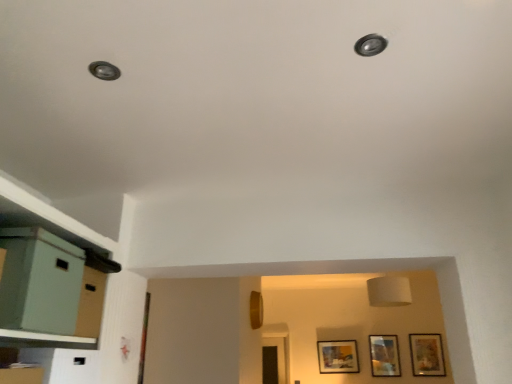
Question: Is matte gold picture frame at lower right, acting as the 3th picture frame starting from the left, taller than wooden picture frame at lower right, the second picture frame in the left-to-right sequence?

Choices:
 (A) no
 (B) yes

Answer: (B)

Question: Is matte gold picture frame at lower right, acting as the 3th picture frame starting from the left, oriented away from wooden picture frame at lower right, the second picture frame in the left-to-right sequence?

Choices:
 (A) yes
 (B) no

Answer: (B)

Question: From a real-world perspective, is matte gold picture frame at lower right, the first picture frame in the right-to-left sequence, physically below wooden picture frame at lower right, the second picture frame in the left-to-right sequence?

Choices:
 (A) yes
 (B) no

Answer: (B)

Question: Is matte gold picture frame at lower right, acting as the 3th picture frame starting from the left, located outside wooden picture frame at lower right, the 2th picture frame in the right-to-left sequence?

Choices:
 (A) yes
 (B) no

Answer: (A)

Question: Is matte gold picture frame at lower right, acting as the 3th picture frame starting from the left, to the left of wooden picture frame at lower right, the second picture frame in the left-to-right sequence, from the viewer's perspective?

Choices:
 (A) yes
 (B) no

Answer: (B)

Question: Visually, is matte gold picture frame at lower right, acting as the 3th picture frame starting from the left, positioned to the left or to the right of matte wooden picture frame at center, which appears as the third picture frame when viewed from the right?

Choices:
 (A) right
 (B) left

Answer: (A)

Question: From a real-world perspective, relative to matte wooden picture frame at center, which appears as the third picture frame when viewed from the right, is matte gold picture frame at lower right, acting as the 3th picture frame starting from the left, vertically above or below?

Choices:
 (A) above
 (B) below

Answer: (A)

Question: Looking at the image, does matte gold picture frame at lower right, the first picture frame in the right-to-left sequence, seem bigger or smaller compared to matte wooden picture frame at center, marked as the 1th picture frame in a left-to-right arrangement?

Choices:
 (A) big
 (B) small

Answer: (B)

Question: Is matte gold picture frame at lower right, acting as the 3th picture frame starting from the left, wider or thinner than matte wooden picture frame at center, which appears as the third picture frame when viewed from the right?

Choices:
 (A) wide
 (B) thin

Answer: (B)

Question: From the image's perspective, is matte green file cabinet at left located above or below matte wooden picture frame at center, marked as the 1th picture frame in a left-to-right arrangement?

Choices:
 (A) above
 (B) below

Answer: (A)

Question: From a real-world perspective, is matte green file cabinet at left positioned above or below matte wooden picture frame at center, which appears as the third picture frame when viewed from the right?

Choices:
 (A) below
 (B) above

Answer: (B)

Question: Is matte green file cabinet at left wider or thinner than matte wooden picture frame at center, which appears as the third picture frame when viewed from the right?

Choices:
 (A) wide
 (B) thin

Answer: (A)

Question: Would you say matte green file cabinet at left is inside or outside matte wooden picture frame at center, which appears as the third picture frame when viewed from the right?

Choices:
 (A) outside
 (B) inside

Answer: (A)

Question: Would you say matte wooden picture frame at center, marked as the 1th picture frame in a left-to-right arrangement, is inside or outside matte gold picture frame at lower right, acting as the 3th picture frame starting from the left?

Choices:
 (A) outside
 (B) inside

Answer: (A)

Question: Is point (356, 354) positioned closer to the camera than point (439, 370)?

Choices:
 (A) closer
 (B) farther

Answer: (B)